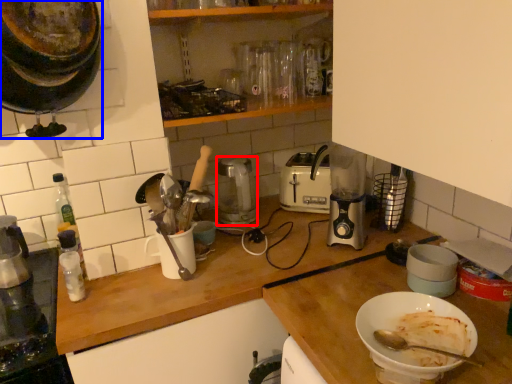
Question: Among these objects, which one is farthest to the camera, kitchen appliance (highlighted by a red box) or kitchen appliance (highlighted by a blue box)?

Choices:
 (A) kitchen appliance
 (B) kitchen appliance

Answer: (A)